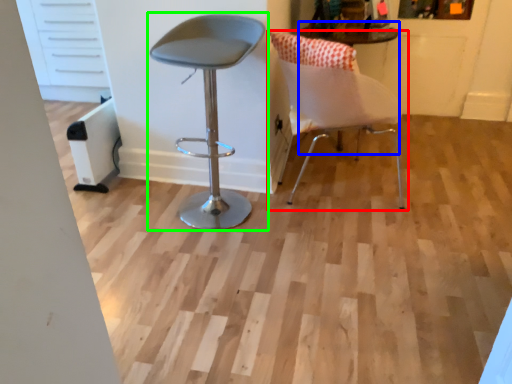
Question: Which object is the closest to the chair (highlighted by a red box)? Choose among these: round table (highlighted by a blue box) or chair (highlighted by a green box).

Choices:
 (A) round table
 (B) chair

Answer: (B)